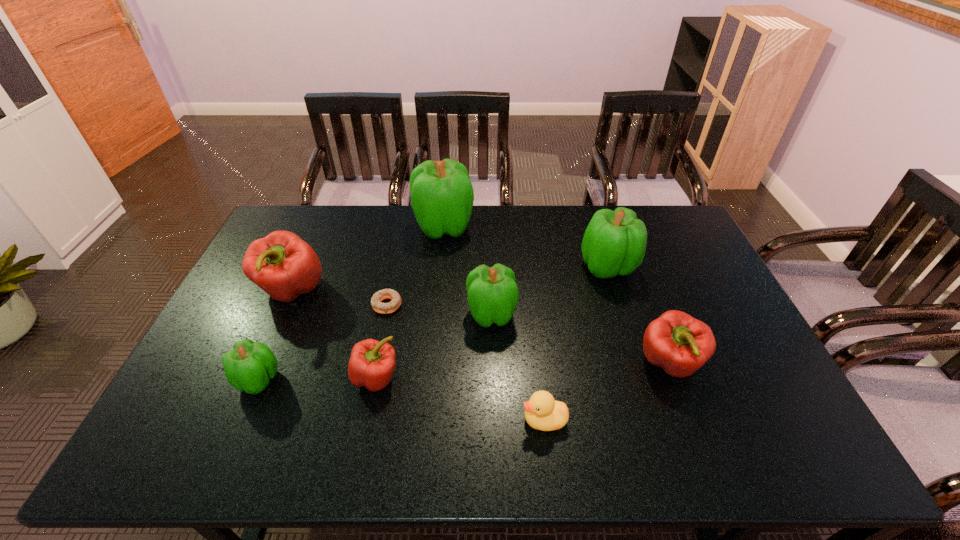
Find the location of a particular element. The image size is (960, 540). the tallest bell pepper is located at coordinates (442, 196).

The width and height of the screenshot is (960, 540). Identify the location of the biggest green bell pepper. (442, 196).

Where is `the rightmost green bell pepper`? The width and height of the screenshot is (960, 540). the rightmost green bell pepper is located at coordinates (614, 242).

Identify the location of the second biggest green bell pepper. click(x=614, y=242).

At what (x,y) coordinates should I click in order to perform the action: click on the farthest pink bell pepper. Please return your answer as a coordinate pair (x, y). Looking at the image, I should click on (283, 265).

The height and width of the screenshot is (540, 960). In order to click on the biggest pink bell pepper in this screenshot , I will do pos(283,265).

Where is `the third farthest green bell pepper`? The height and width of the screenshot is (540, 960). the third farthest green bell pepper is located at coordinates (493, 294).

In order to click on the second biggest pink bell pepper in this screenshot , I will do `click(680, 344)`.

Locate an element on the screen. Image resolution: width=960 pixels, height=540 pixels. the leftmost green bell pepper is located at coordinates (250, 365).

Find the location of a particular element. the nearest green bell pepper is located at coordinates (250, 365).